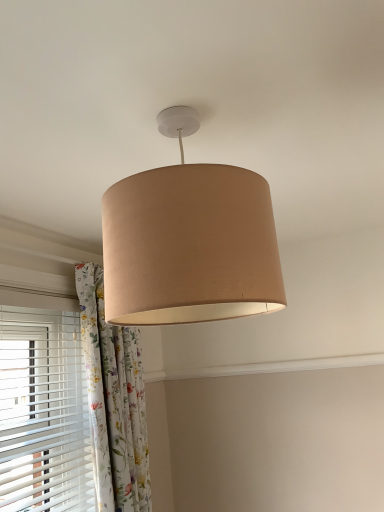
Question: From the image's perspective, is floral fabric curtain at center above beige fabric lampshade at center?

Choices:
 (A) no
 (B) yes

Answer: (A)

Question: Is floral fabric curtain at center oriented away from beige fabric lampshade at center?

Choices:
 (A) no
 (B) yes

Answer: (A)

Question: Are floral fabric curtain at center and beige fabric lampshade at center far apart?

Choices:
 (A) no
 (B) yes

Answer: (A)

Question: Are floral fabric curtain at center and beige fabric lampshade at center making contact?

Choices:
 (A) yes
 (B) no

Answer: (B)

Question: Is floral fabric curtain at center shorter than beige fabric lampshade at center?

Choices:
 (A) yes
 (B) no

Answer: (B)

Question: Is floral fabric curtain at center smaller than beige fabric lampshade at center?

Choices:
 (A) no
 (B) yes

Answer: (A)

Question: Does beige fabric lampshade at center come behind floral fabric curtain at center?

Choices:
 (A) no
 (B) yes

Answer: (A)

Question: Does beige fabric lampshade at center have a smaller size compared to floral fabric curtain at center?

Choices:
 (A) yes
 (B) no

Answer: (A)

Question: Is beige fabric lampshade at center positioned with its back to floral fabric curtain at center?

Choices:
 (A) yes
 (B) no

Answer: (B)

Question: Is floral fabric curtain at center inside beige fabric lampshade at center?

Choices:
 (A) no
 (B) yes

Answer: (A)

Question: Is beige fabric lampshade at center far away from floral fabric curtain at center?

Choices:
 (A) yes
 (B) no

Answer: (B)

Question: From the image's perspective, does beige fabric lampshade at center appear lower than floral fabric curtain at center?

Choices:
 (A) yes
 (B) no

Answer: (B)

Question: In terms of height, does beige fabric lampshade at center look taller or shorter compared to floral fabric curtain at center?

Choices:
 (A) tall
 (B) short

Answer: (B)